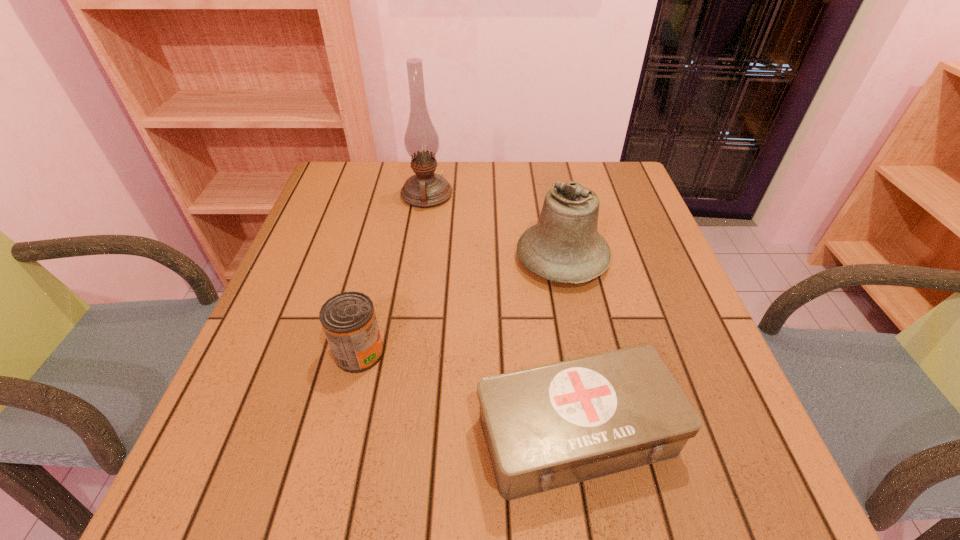
The image size is (960, 540). In order to click on oil lamp in this screenshot , I will do `click(426, 189)`.

Identify the location of the tallest object. This screenshot has height=540, width=960. (426, 189).

You are a GUI agent. You are given a task and a screenshot of the screen. Output one action in this format:
    pyautogui.click(x=<x>, y=<y>)
    Task: Click on the second tallest object
    This screenshot has height=540, width=960.
    Given the screenshot: What is the action you would take?
    pyautogui.click(x=565, y=246)

Locate an element on the screen. This screenshot has height=540, width=960. the third nearest object is located at coordinates (565, 246).

Locate an element on the screen. can is located at coordinates (348, 319).

At what (x,y) coordinates should I click in order to perform the action: click on the second nearest object. Please return your answer as a coordinate pair (x, y). Looking at the image, I should click on (348, 319).

I want to click on the first-aid kit, so click(546, 427).

Locate an element on the screen. the nearest object is located at coordinates (546, 427).

Identify the location of vacant area located on the front of the farthest object. (416, 269).

Where is `vacant area situated on the back of the second farthest object`? The image size is (960, 540). vacant area situated on the back of the second farthest object is located at coordinates (547, 184).